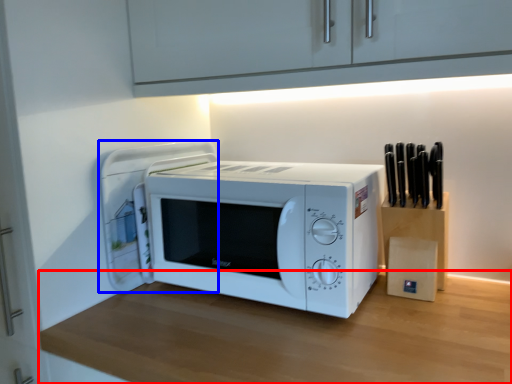
Question: Among these objects, which one is nearest to the camera, table (highlighted by a red box) or appliance (highlighted by a blue box)?

Choices:
 (A) table
 (B) appliance

Answer: (A)